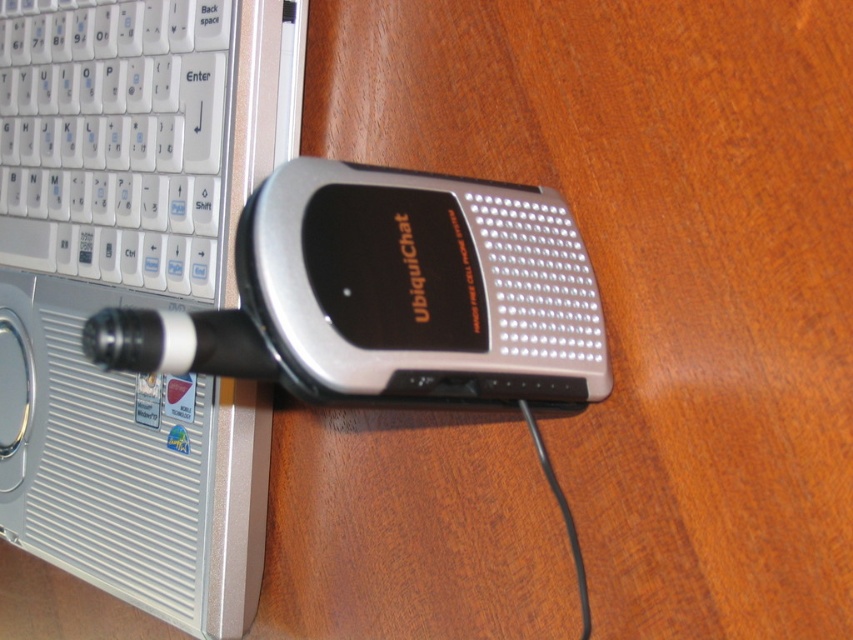
Find the location of `silver metallic laptop at left`. silver metallic laptop at left is located at coordinates (135, 288).

Locate an element on the screen. silver metallic laptop at left is located at coordinates click(135, 288).